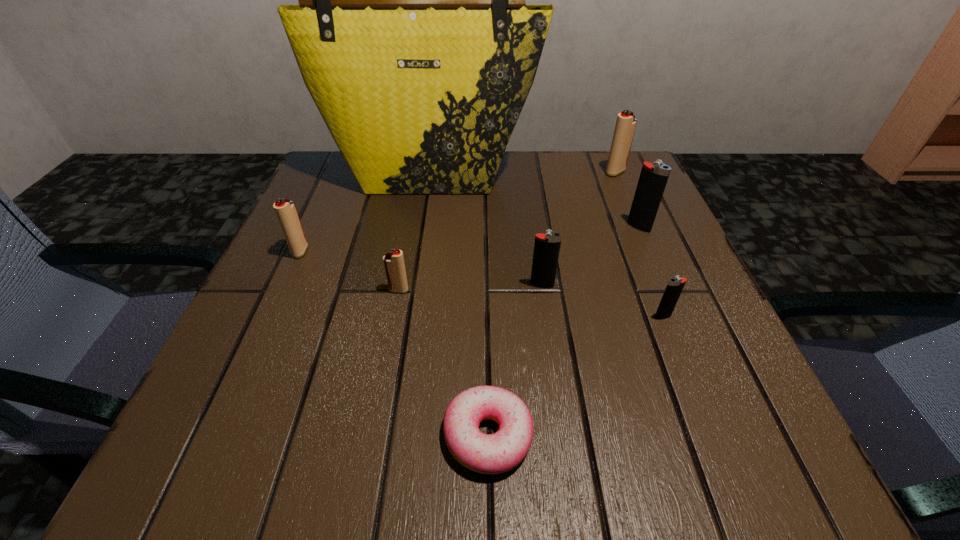
Where is `red igniter that is the third closest to the nearest object`? red igniter that is the third closest to the nearest object is located at coordinates (625, 127).

This screenshot has height=540, width=960. I want to click on red igniter that is the second closest to the doughnut, so click(285, 210).

Point out which black igniter is positioned as the third nearest to the tallest object. Please provide its 2D coordinates. Your answer should be formatted as a tuple, i.e. [(x, y)], where the tuple contains the x and y coordinates of a point satisfying the conditions above.

[(675, 285)]

In order to click on black igniter that can be found as the closest to the second red igniter from right to left in this screenshot , I will do `click(547, 246)`.

The image size is (960, 540). Identify the location of vacant space that satisfies the following two spatial constraints: 1. on the front-facing side of the second farthest black igniter; 2. on the left side of the tote bag. (413, 286).

Identify the location of vacant position in the image that satisfies the following two spatial constraints: 1. on the front-facing side of the yellow tote bag; 2. on the left side of the third igniter from left to right. (413, 286).

This screenshot has width=960, height=540. Find the location of `vacant space that satisfies the following two spatial constraints: 1. on the front-facing side of the yellow tote bag; 2. on the right side of the sixth nearest object`. vacant space that satisfies the following two spatial constraints: 1. on the front-facing side of the yellow tote bag; 2. on the right side of the sixth nearest object is located at coordinates (422, 227).